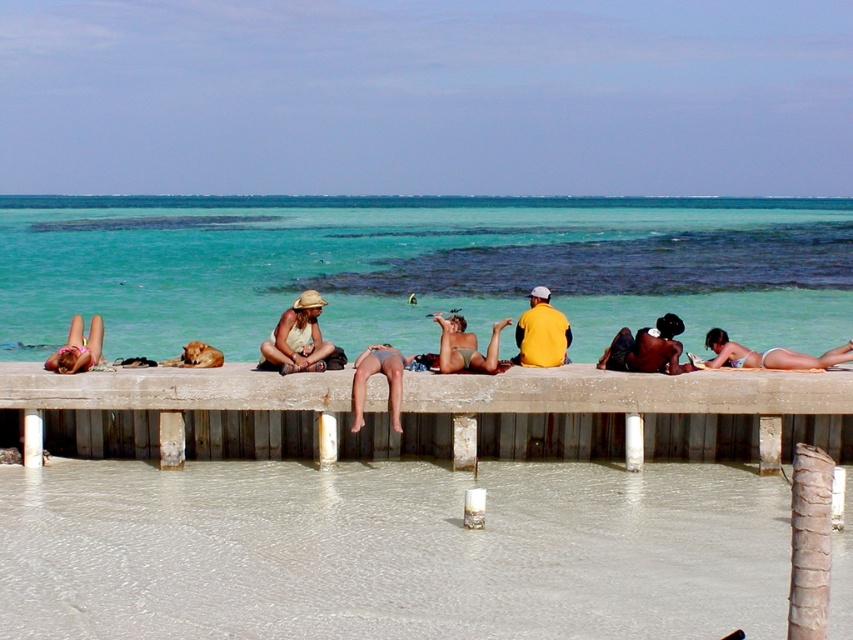
Question: Is the position of shiny black skin at center more distant than that of yellow matte shirt at center?

Choices:
 (A) yes
 (B) no

Answer: (B)

Question: Which point is farther from the camera taking this photo?

Choices:
 (A) (183, 518)
 (B) (541, 300)
 (C) (262, 349)
 (D) (677, 364)

Answer: (B)

Question: Among these points, which one is farthest from the camera?

Choices:
 (A) (521, 333)
 (B) (836, 362)

Answer: (A)

Question: Which point appears closest to the camera in this image?

Choices:
 (A) (288, 321)
 (B) (358, 358)
 (C) (154, 513)

Answer: (C)

Question: Can you confirm if smooth concrete surface at lower center is positioned above matte beige hat at center?

Choices:
 (A) yes
 (B) no

Answer: (B)

Question: Is the position of smooth concrete surface at lower center less distant than that of matte bikini at center?

Choices:
 (A) yes
 (B) no

Answer: (A)